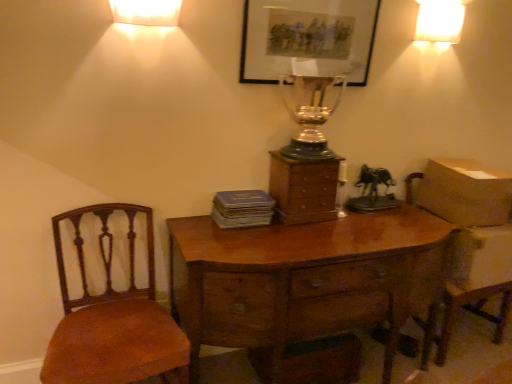
Where is `vacant space to the left of matte gray book at center`? This screenshot has height=384, width=512. vacant space to the left of matte gray book at center is located at coordinates (195, 228).